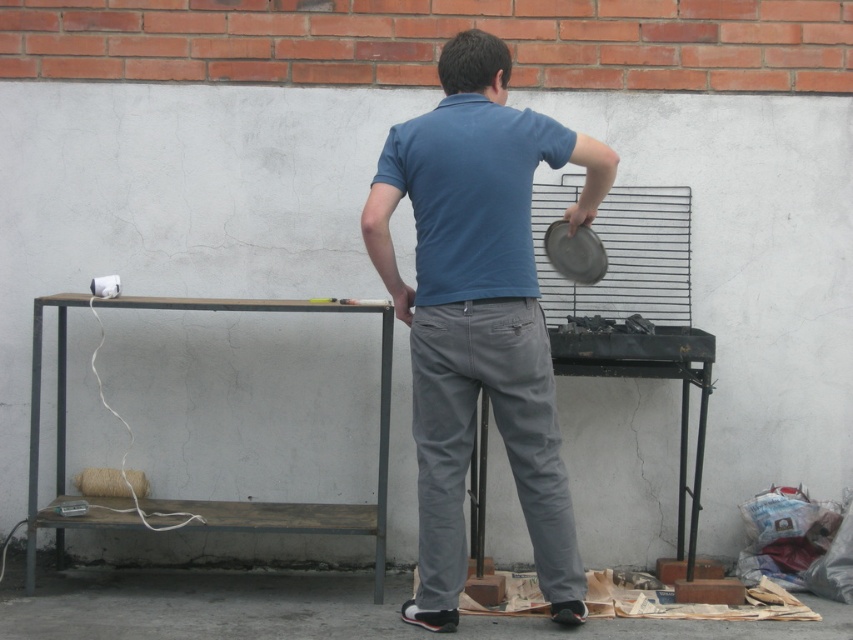
You are a photographer trying to capture a candid shot of the scene. You notice the blue cotton shirt at center and the wooden table at lower left. Which object should you focus on first if you want to capture the taller object in your frame?

The blue cotton shirt at center is taller than the wooden table at lower left, so you should focus on the blue cotton shirt at center first to capture the taller object in your frame.

You are a delivery person who needs to place a package on the wooden table at lower left. The package is 28 inches wide. Can you fit it on the table without moving the blue cotton shirt at center?

The blue cotton shirt at center is 27.79 inches from the wooden table at lower left. Since the package is 28 inches wide, it is slightly wider than the distance between them, so placing the package on the table without moving the shirt would not be possible.

Based on the photo, you are standing in the outdoor area and need to place a small plate between the blue cotton shirt at center and the wooden table at lower left. Which object should you place it closer to if you want the plate to be nearer to the narrower one?

The blue cotton shirt at center has a lesser width compared to wooden table at lower left, so you should place the plate closer to the blue cotton shirt at center to be nearer to the narrower one.